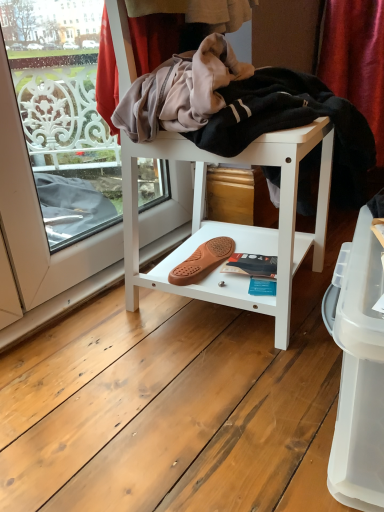
Where is `velvet dark red curtain at upper right`? The width and height of the screenshot is (384, 512). velvet dark red curtain at upper right is located at coordinates (356, 59).

What do you see at coordinates (356, 59) in the screenshot?
I see `velvet dark red curtain at upper right` at bounding box center [356, 59].

Locate an element on the screen. The height and width of the screenshot is (512, 384). velvet dark red curtain at upper right is located at coordinates (356, 59).